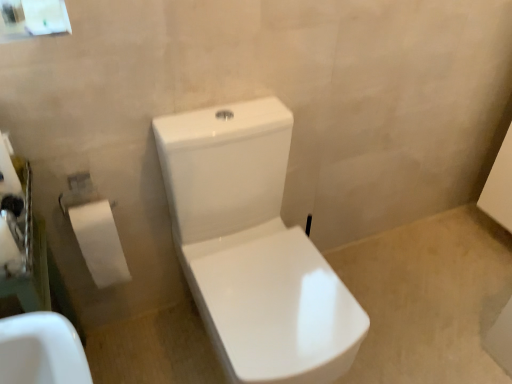
Question: Would you consider white paper at left to be distant from white paper at left?

Choices:
 (A) no
 (B) yes

Answer: (A)

Question: Is white paper at left not within white paper at left?

Choices:
 (A) yes
 (B) no

Answer: (A)

Question: Considering the relative sizes of white paper at left and white paper at left in the image provided, is white paper at left wider than white paper at left?

Choices:
 (A) no
 (B) yes

Answer: (A)

Question: Would you say white paper at left contains white paper at left?

Choices:
 (A) no
 (B) yes

Answer: (A)

Question: Does white paper at left have a lesser width compared to white paper at left?

Choices:
 (A) no
 (B) yes

Answer: (B)

Question: Is white glossy toilet at center wider or thinner than white paper at left?

Choices:
 (A) wide
 (B) thin

Answer: (A)

Question: Would you say white glossy toilet at center is inside or outside white paper at left?

Choices:
 (A) outside
 (B) inside

Answer: (A)

Question: Considering the positions of white glossy toilet at center and white paper at left in the image, is white glossy toilet at center taller or shorter than white paper at left?

Choices:
 (A) tall
 (B) short

Answer: (A)

Question: Considering their positions, is white glossy toilet at center located in front of or behind white paper at left?

Choices:
 (A) front
 (B) behind

Answer: (A)

Question: Would you say white paper at left is to the left or to the right of white paper at left in the picture?

Choices:
 (A) right
 (B) left

Answer: (A)

Question: In terms of width, does white paper at left look wider or thinner when compared to white paper at left?

Choices:
 (A) thin
 (B) wide

Answer: (B)

Question: Is white paper at left inside or outside of white paper at left?

Choices:
 (A) outside
 (B) inside

Answer: (A)

Question: Is point (91, 251) positioned closer to the camera than point (20, 266)?

Choices:
 (A) closer
 (B) farther

Answer: (B)

Question: In the image, is white paper at left positioned in front of or behind white glossy toilet at center?

Choices:
 (A) behind
 (B) front

Answer: (A)

Question: From a real-world perspective, is white paper at left positioned above or below white glossy toilet at center?

Choices:
 (A) above
 (B) below

Answer: (A)